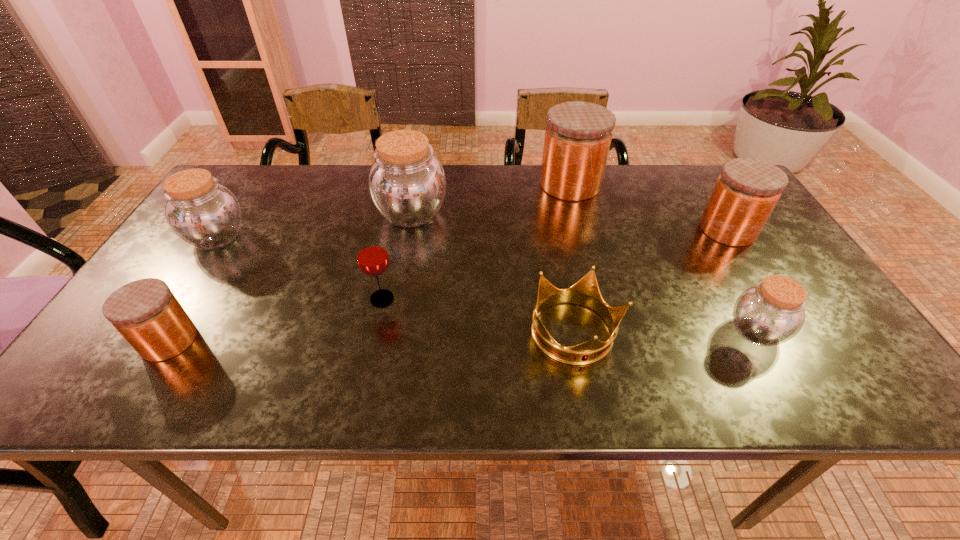
Where is `unoccupied position between the glass and the rightmost orange jar`? This screenshot has width=960, height=540. unoccupied position between the glass and the rightmost orange jar is located at coordinates (555, 264).

The image size is (960, 540). Identify the location of vacant space in between the biggest orange jar and the shortest object. (572, 259).

You are a GUI agent. You are given a task and a screenshot of the screen. Output one action in this format:
    pyautogui.click(x=<x>, y=<y>)
    Task: Click on the vacant space that's between the nearest brown jar and the rightmost orange jar
    
    Given the screenshot: What is the action you would take?
    pyautogui.click(x=742, y=280)

Locate an element on the screen. Image resolution: width=960 pixels, height=540 pixels. free spot between the smallest brown jar and the biggest brown jar is located at coordinates (584, 273).

Where is `vacant area between the glass and the second smallest brown jar`? Image resolution: width=960 pixels, height=540 pixels. vacant area between the glass and the second smallest brown jar is located at coordinates (300, 268).

The height and width of the screenshot is (540, 960). Find the location of `empty space that is in between the crown and the red glass`. empty space that is in between the crown and the red glass is located at coordinates (478, 316).

Identify the location of free space between the second smallest brown jar and the shortest object. (396, 285).

The width and height of the screenshot is (960, 540). What are the coordinates of `empty location between the glass and the crown` in the screenshot? It's located at (478, 316).

Locate which object is the seventh closest to the second smallest orange jar. Please provide its 2D coordinates. Your answer should be formatted as a tuple, i.e. [(x, y)], where the tuple contains the x and y coordinates of a point satisfying the conditions above.

[(145, 312)]

What are the coordinates of `object that ranks as the seventh closest to the second biggest brown jar` in the screenshot? It's located at (747, 190).